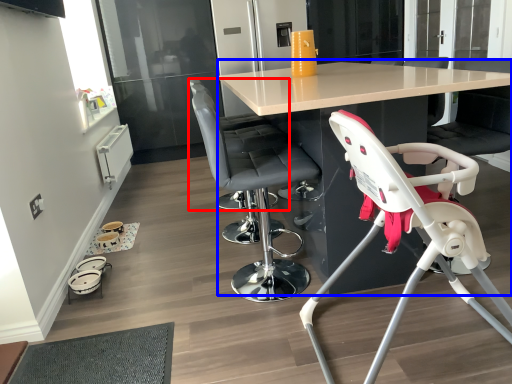
Question: Among these objects, which one is nearest to the camera, chair (highlighted by a red box) or table (highlighted by a blue box)?

Choices:
 (A) chair
 (B) table

Answer: (B)